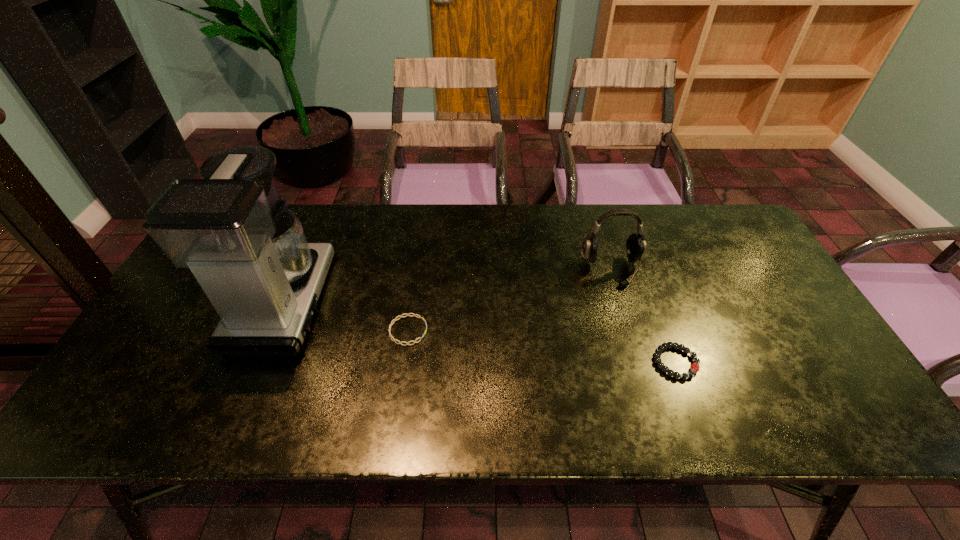
This screenshot has height=540, width=960. I want to click on vacant area in the image that satisfies the following two spatial constraints: 1. on the surface of the left bracelet showing star-shaped elements; 2. on the right side of the third tallest object, so click(403, 362).

Image resolution: width=960 pixels, height=540 pixels. Identify the location of vacant space that satisfies the following two spatial constraints: 1. on the surface of the second object from left to right showing star-shaped elements; 2. on the left side of the taller bracelet. (403, 362).

Where is `free region that satisfies the following two spatial constraints: 1. on the surface of the right bracelet showing star-shaped elements; 2. on the right side of the shortest object`? The image size is (960, 540). free region that satisfies the following two spatial constraints: 1. on the surface of the right bracelet showing star-shaped elements; 2. on the right side of the shortest object is located at coordinates (403, 362).

Where is `vacant point that satisfies the following two spatial constraints: 1. at the front of the leftmost object where the controls are located; 2. on the back side of the taller bracelet`? vacant point that satisfies the following two spatial constraints: 1. at the front of the leftmost object where the controls are located; 2. on the back side of the taller bracelet is located at coordinates (259, 362).

This screenshot has width=960, height=540. I want to click on vacant space that satisfies the following two spatial constraints: 1. with the microphone on the side of the headset; 2. at the front of the coffee maker where the controls are located, so click(621, 301).

Find the location of a particular element. This screenshot has height=540, width=960. free region that satisfies the following two spatial constraints: 1. at the front of the second shortest object where the controls are located; 2. on the left side of the tallest object is located at coordinates (259, 362).